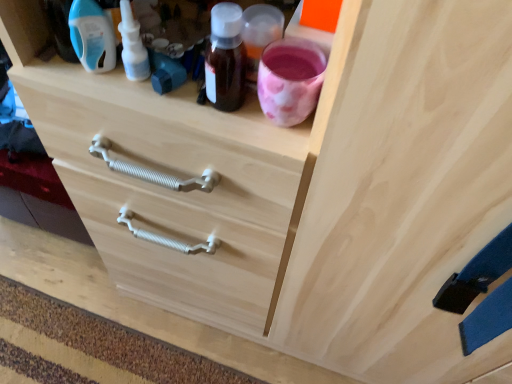
Question: Does blue plastic bottle at upper left, which ranks as the 1th bottle in left-to-right order, have a smaller size compared to white plastic nasal spray at upper left, acting as the first bottle starting from the right?

Choices:
 (A) no
 (B) yes

Answer: (A)

Question: From the image's perspective, is blue plastic bottle at upper left, the 2th bottle in the right-to-left sequence, below white plastic nasal spray at upper left, the 2th bottle viewed from the left?

Choices:
 (A) no
 (B) yes

Answer: (A)

Question: Is there a large distance between blue plastic bottle at upper left, which ranks as the 1th bottle in left-to-right order, and white plastic nasal spray at upper left, acting as the first bottle starting from the right?

Choices:
 (A) no
 (B) yes

Answer: (A)

Question: Considering the relative sizes of blue plastic bottle at upper left, which ranks as the 1th bottle in left-to-right order, and white plastic nasal spray at upper left, acting as the first bottle starting from the right, in the image provided, is blue plastic bottle at upper left, which ranks as the 1th bottle in left-to-right order, bigger than white plastic nasal spray at upper left, acting as the first bottle starting from the right,?

Choices:
 (A) yes
 (B) no

Answer: (A)

Question: Can you confirm if blue plastic bottle at upper left, the 2th bottle in the right-to-left sequence, is thinner than white plastic nasal spray at upper left, acting as the first bottle starting from the right?

Choices:
 (A) no
 (B) yes

Answer: (B)

Question: From a real-world perspective, is white plastic nasal spray at upper left, the 2th bottle viewed from the left, above or below natural wood drawer at center?

Choices:
 (A) above
 (B) below

Answer: (A)

Question: Is white plastic nasal spray at upper left, the 2th bottle viewed from the left, taller or shorter than natural wood drawer at center?

Choices:
 (A) tall
 (B) short

Answer: (A)

Question: Considering the positions of white plastic nasal spray at upper left, the 2th bottle viewed from the left, and natural wood drawer at center in the image, is white plastic nasal spray at upper left, the 2th bottle viewed from the left, bigger or smaller than natural wood drawer at center?

Choices:
 (A) small
 (B) big

Answer: (A)

Question: From the image's perspective, relative to natural wood drawer at center, is white plastic nasal spray at upper left, acting as the first bottle starting from the right, above or below?

Choices:
 (A) below
 (B) above

Answer: (B)

Question: Based on their positions, is white plastic nasal spray at upper left, the 2th bottle viewed from the left, located to the left or right of blue plastic bottle at upper left, the 2th bottle in the right-to-left sequence?

Choices:
 (A) right
 (B) left

Answer: (A)

Question: Looking at the image, does white plastic nasal spray at upper left, the 2th bottle viewed from the left, seem bigger or smaller compared to blue plastic bottle at upper left, which ranks as the 1th bottle in left-to-right order?

Choices:
 (A) big
 (B) small

Answer: (B)

Question: From a real-world perspective, is white plastic nasal spray at upper left, acting as the first bottle starting from the right, positioned above or below blue plastic bottle at upper left, which ranks as the 1th bottle in left-to-right order?

Choices:
 (A) below
 (B) above

Answer: (A)

Question: Is point (137, 48) closer or farther from the camera than point (87, 41)?

Choices:
 (A) farther
 (B) closer

Answer: (A)

Question: Is natural wood drawer at center bigger or smaller than blue plastic bottle at upper left, the 2th bottle in the right-to-left sequence?

Choices:
 (A) big
 (B) small

Answer: (A)

Question: In the image, is natural wood drawer at center positioned in front of or behind blue plastic bottle at upper left, which ranks as the 1th bottle in left-to-right order?

Choices:
 (A) behind
 (B) front

Answer: (A)